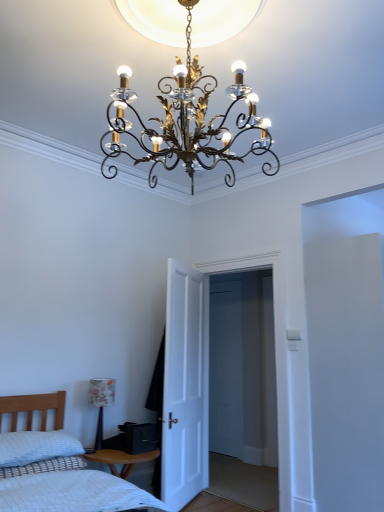
Question: Does white quilted bed at lower left have a lesser height compared to white matte door at center?

Choices:
 (A) yes
 (B) no

Answer: (A)

Question: Is white quilted bed at lower left directly adjacent to white matte door at center?

Choices:
 (A) yes
 (B) no

Answer: (B)

Question: Is white quilted bed at lower left far away from white matte door at center?

Choices:
 (A) yes
 (B) no

Answer: (A)

Question: Is white quilted bed at lower left oriented towards white matte door at center?

Choices:
 (A) yes
 (B) no

Answer: (B)

Question: Is white quilted bed at lower left to the right of white matte door at center from the viewer's perspective?

Choices:
 (A) yes
 (B) no

Answer: (B)

Question: Is white quilted bed at lower left bigger than white matte door at center?

Choices:
 (A) yes
 (B) no

Answer: (A)

Question: Is the depth of white matte door at center greater than that of floral-patterned fabric lampshade at lower left, the 1th lamp viewed from the left?

Choices:
 (A) yes
 (B) no

Answer: (B)

Question: Is floral-patterned fabric lampshade at lower left, the 2th lamp in the top-to-bottom sequence, inside white matte door at center?

Choices:
 (A) no
 (B) yes

Answer: (A)

Question: Would you say white matte door at center is outside floral-patterned fabric lampshade at lower left, which is the 2th lamp in front-to-back order?

Choices:
 (A) no
 (B) yes

Answer: (B)

Question: Considering the relative sizes of white matte door at center and floral-patterned fabric lampshade at lower left, which is the second lamp from right to left, in the image provided, is white matte door at center smaller than floral-patterned fabric lampshade at lower left, which is the second lamp from right to left,?

Choices:
 (A) yes
 (B) no

Answer: (B)

Question: Considering the relative sizes of white matte door at center and floral-patterned fabric lampshade at lower left, the 1th lamp positioned from the back, in the image provided, is white matte door at center taller than floral-patterned fabric lampshade at lower left, the 1th lamp positioned from the back,?

Choices:
 (A) no
 (B) yes

Answer: (B)

Question: Is white matte door at center shorter than floral-patterned fabric lampshade at lower left, the 1th lamp positioned from the back?

Choices:
 (A) no
 (B) yes

Answer: (A)

Question: Considering the relative sizes of white textured pillow at lower left and gold metallic chandelier at center, marked as the second lamp in a bottom-to-top arrangement, in the image provided, is white textured pillow at lower left bigger than gold metallic chandelier at center, marked as the second lamp in a bottom-to-top arrangement,?

Choices:
 (A) yes
 (B) no

Answer: (B)